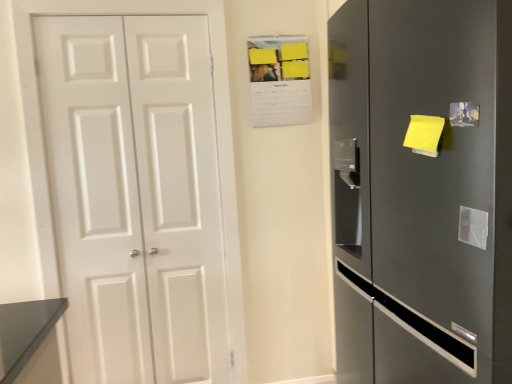
Identify the location of satin silver refrigerator at right. The image size is (512, 384). (422, 190).

What do you see at coordinates (422, 190) in the screenshot? The width and height of the screenshot is (512, 384). I see `satin silver refrigerator at right` at bounding box center [422, 190].

What are the coordinates of `white matte door at left` in the screenshot? It's located at (135, 196).

The image size is (512, 384). What do you see at coordinates (135, 196) in the screenshot?
I see `white matte door at left` at bounding box center [135, 196].

At what (x,y) coordinates should I click in order to perform the action: click on satin silver refrigerator at right. Please return your answer as a coordinate pair (x, y). This screenshot has width=512, height=384. Looking at the image, I should click on (422, 190).

Consider the image. Between satin silver refrigerator at right and white matte door at left, which one appears on the left side from the viewer's perspective?

Positioned to the left is white matte door at left.

Which object is more forward, satin silver refrigerator at right or white matte door at left?

satin silver refrigerator at right is in front.

Which point is more distant from viewer, [419,364] or [103,341]?

Positioned behind is point [103,341].

From the image's perspective, would you say satin silver refrigerator at right is positioned over white matte door at left?

Actually, satin silver refrigerator at right appears below white matte door at left in the image.

From a real-world perspective, is satin silver refrigerator at right physically below white matte door at left?

Yes, from a real-world perspective, satin silver refrigerator at right is under white matte door at left.

Consider the image. Between satin silver refrigerator at right and white matte door at left, which one has smaller width?

With smaller width is white matte door at left.

Which of these two, satin silver refrigerator at right or white matte door at left, stands taller?

white matte door at left.

Is satin silver refrigerator at right bigger or smaller than white matte door at left?

In the image, satin silver refrigerator at right appears to be larger than white matte door at left.

Can white matte door at left be found inside satin silver refrigerator at right?

No, white matte door at left is not surrounded by satin silver refrigerator at right.

Is satin silver refrigerator at right far away from white matte door at left?

Indeed, satin silver refrigerator at right is not near white matte door at left.

Is white matte door at left at the back of satin silver refrigerator at right?

satin silver refrigerator at right is not turned away from white matte door at left.

Where is `refrigerator below the white matte door at left (from a real-world perspective)`? refrigerator below the white matte door at left (from a real-world perspective) is located at coordinates point(422,190).

Looking at this image, which object is positioned more to the left, white matte door at left or satin silver refrigerator at right?

white matte door at left is more to the left.

Does white matte door at left come in front of satin silver refrigerator at right?

No, white matte door at left is behind satin silver refrigerator at right.

Is point (47, 151) less distant than point (373, 372)?

No, (47, 151) is behind (373, 372).

From the image's perspective, is white matte door at left beneath satin silver refrigerator at right?

Actually, white matte door at left appears above satin silver refrigerator at right in the image.

From a real-world perspective, does white matte door at left stand above satin silver refrigerator at right?

Yes, from a real-world perspective, white matte door at left is above satin silver refrigerator at right.

Does white matte door at left have a greater width compared to satin silver refrigerator at right?

In fact, white matte door at left might be narrower than satin silver refrigerator at right.

Who is shorter, white matte door at left or satin silver refrigerator at right?

satin silver refrigerator at right.

Based on their sizes in the image, would you say white matte door at left is bigger or smaller than satin silver refrigerator at right?

In the image, white matte door at left appears to be smaller than satin silver refrigerator at right.

Can satin silver refrigerator at right be found inside white matte door at left?

No, satin silver refrigerator at right is not surrounded by white matte door at left.

Does white matte door at left touch satin silver refrigerator at right?

No, white matte door at left is not touching satin silver refrigerator at right.

Is white matte door at left facing towards satin silver refrigerator at right?

No, white matte door at left is not aimed at satin silver refrigerator at right.

Consider the image. Can you tell me how much white matte door at left and satin silver refrigerator at right differ in facing direction?

The angle between the facing direction of white matte door at left and the facing direction of satin silver refrigerator at right is 91 degrees.

Where is `refrigerator below the white matte door at left (from the image's perspective)`? refrigerator below the white matte door at left (from the image's perspective) is located at coordinates (422, 190).

Image resolution: width=512 pixels, height=384 pixels. I want to click on refrigerator that is under the white matte door at left (from a real-world perspective), so click(x=422, y=190).

The height and width of the screenshot is (384, 512). What are the coordinates of `door located above the satin silver refrigerator at right (from a real-world perspective)` in the screenshot? It's located at (135, 196).